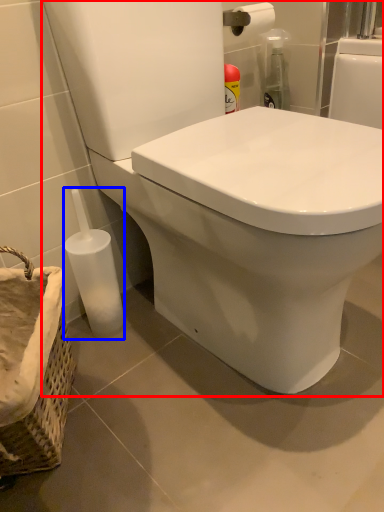
Question: Which object appears closest to the camera in this image, toilet (highlighted by a red box) or bottle (highlighted by a blue box)?

Choices:
 (A) toilet
 (B) bottle

Answer: (A)